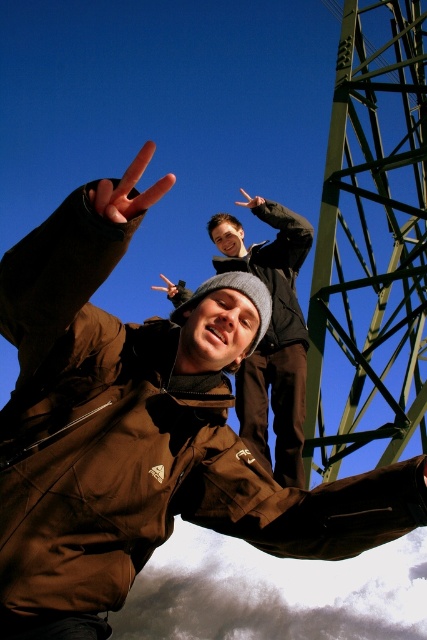
Can you confirm if brown fabric hand at upper center is bigger than matte black hand at upper center?

No, brown fabric hand at upper center is not bigger than matte black hand at upper center.

Can you confirm if brown fabric hand at upper center is positioned to the left of matte black hand at upper center?

Indeed, brown fabric hand at upper center is positioned on the left side of matte black hand at upper center.

Locate an element on the screen. Image resolution: width=427 pixels, height=640 pixels. brown fabric hand at upper center is located at coordinates (70, 259).

Is dark brown jacket at upper center taller than pinkish flesh-toned finger at upper center?

Yes.

Who is positioned more to the left, dark brown jacket at upper center or pinkish flesh-toned finger at upper center?

pinkish flesh-toned finger at upper center

Between point (251, 204) and point (99, 196), which one is positioned behind?

The point (251, 204) is more distant.

The height and width of the screenshot is (640, 427). Identify the location of dark brown jacket at upper center. (280, 236).

Does brown fabric hand at upper center have a lesser height compared to dark brown jacket at upper center?

Correct, brown fabric hand at upper center is not as tall as dark brown jacket at upper center.

Is point (11, 248) farther from camera compared to point (259, 259)?

That is False.

The width and height of the screenshot is (427, 640). I want to click on brown fabric hand at upper center, so click(x=70, y=259).